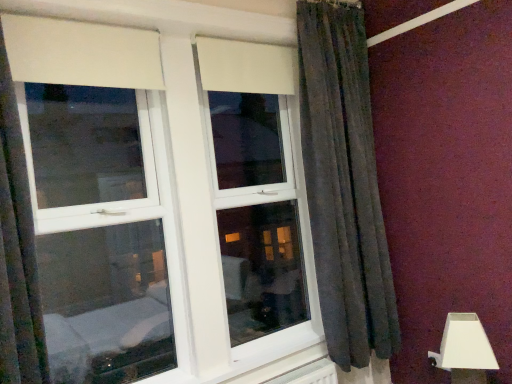
Describe the element at coordinates (465, 350) in the screenshot. The image size is (512, 384). I see `white plastic table lamp at lower right` at that location.

Where is `white plastic table lamp at lower right`? Image resolution: width=512 pixels, height=384 pixels. white plastic table lamp at lower right is located at coordinates (465, 350).

The width and height of the screenshot is (512, 384). In order to click on white plastic window at upper center in this screenshot , I will do `click(162, 206)`.

What do you see at coordinates (162, 206) in the screenshot? I see `white plastic window at upper center` at bounding box center [162, 206].

The height and width of the screenshot is (384, 512). I want to click on white plastic table lamp at lower right, so click(465, 350).

Visually, is white plastic table lamp at lower right positioned to the left or to the right of white plastic window at upper center?

In the image, white plastic table lamp at lower right appears on the right side of white plastic window at upper center.

Is white plastic table lamp at lower right positioned in front of white plastic window at upper center?

No, white plastic table lamp at lower right is further to the viewer.

Which is nearer, (474, 332) or (203, 222)?

The point (474, 332) is closer to the camera.

Based on the photo, from the image's perspective, which one is positioned higher, white plastic table lamp at lower right or white plastic window at upper center?

white plastic window at upper center is shown above in the image.

From a real-world perspective, between white plastic table lamp at lower right and white plastic window at upper center, who is vertically lower?

white plastic table lamp at lower right is physically lower.

Is white plastic table lamp at lower right wider or thinner than white plastic window at upper center?

white plastic table lamp at lower right is wider than white plastic window at upper center.

Is white plastic table lamp at lower right taller than white plastic window at upper center?

No.

Can you confirm if white plastic table lamp at lower right is smaller than white plastic window at upper center?

Yes.

Is white plastic table lamp at lower right outside of white plastic window at upper center?

That's correct, white plastic table lamp at lower right is outside of white plastic window at upper center.

Are white plastic table lamp at lower right and white plastic window at upper center located far from each other?

Yes, white plastic table lamp at lower right and white plastic window at upper center are quite far apart.

Is white plastic table lamp at lower right oriented away from white plastic window at upper center?

That's not correct — white plastic table lamp at lower right is not looking away from white plastic window at upper center.

What's the angular difference between white plastic table lamp at lower right and white plastic window at upper center's facing directions?

white plastic table lamp at lower right and white plastic window at upper center are facing 90.3 degrees away from each other.

The image size is (512, 384). In order to click on table lamp on the right side of white plastic window at upper center in this screenshot , I will do [x=465, y=350].

Which is more to the right, white plastic window at upper center or white plastic table lamp at lower right?

Positioned to the right is white plastic table lamp at lower right.

Which is behind, white plastic window at upper center or white plastic table lamp at lower right?

Positioned behind is white plastic table lamp at lower right.

Between point (232, 352) and point (484, 377), which one is positioned in front?

Point (484, 377)

From the image's perspective, is white plastic window at upper center on white plastic table lamp at lower right?

Correct, white plastic window at upper center appears higher than white plastic table lamp at lower right in the image.

From a real-world perspective, is white plastic window at upper center below white plastic table lamp at lower right?

No.

Based on the photo, considering the sizes of white plastic window at upper center and white plastic table lamp at lower right in the image, is white plastic window at upper center wider or thinner than white plastic table lamp at lower right?

Clearly, white plastic window at upper center has less width compared to white plastic table lamp at lower right.

Who is shorter, white plastic window at upper center or white plastic table lamp at lower right?

Standing shorter between the two is white plastic table lamp at lower right.

Does white plastic window at upper center have a larger size compared to white plastic table lamp at lower right?

Correct, white plastic window at upper center is larger in size than white plastic table lamp at lower right.

Is white plastic window at upper center situated inside white plastic table lamp at lower right or outside?

white plastic window at upper center is located beyond the bounds of white plastic table lamp at lower right.

Are white plastic window at upper center and white plastic table lamp at lower right located far from each other?

Yes, white plastic window at upper center and white plastic table lamp at lower right are located far from each other.

Is white plastic window at upper center aimed at white plastic table lamp at lower right?

Yes.

From the picture: Can you tell me how much white plastic window at upper center and white plastic table lamp at lower right differ in facing direction?

The angular difference between white plastic window at upper center and white plastic table lamp at lower right is 90.3 degrees.

Locate an element on the screen. This screenshot has width=512, height=384. table lamp behind the white plastic window at upper center is located at coordinates (465, 350).

Locate an element on the screen. The width and height of the screenshot is (512, 384). table lamp located on the right of white plastic window at upper center is located at coordinates (465, 350).

Locate an element on the screen. The height and width of the screenshot is (384, 512). table lamp directly beneath the white plastic window at upper center (from a real-world perspective) is located at coordinates (465, 350).